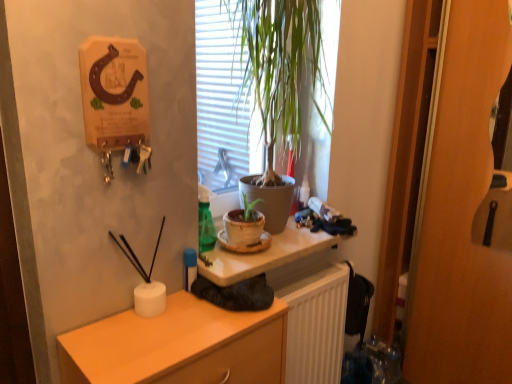
What is the approximate height of matte white desk at center?

matte white desk at center is 1.33 inches tall.

Measure the distance between point [155,350] and camera.

The distance of point [155,350] from camera is 35.87 inches.

What is the approximate width of matte orange cabinet at lower left?

It is 28.24 centimeters.

What do you see at coordinates (279, 68) in the screenshot?
I see `green leafy plant at center` at bounding box center [279, 68].

Image resolution: width=512 pixels, height=384 pixels. Describe the element at coordinates (315, 323) in the screenshot. I see `white ribbed radiator at lower center` at that location.

Locate an element on the screen. Image resolution: width=512 pixels, height=384 pixels. matte white desk at center is located at coordinates (266, 255).

From the image's perspective, is green leafy plant at center located above or below white ribbed radiator at lower center?

green leafy plant at center is above white ribbed radiator at lower center.

Is green leafy plant at center situated inside white ribbed radiator at lower center or outside?

green leafy plant at center is outside white ribbed radiator at lower center.

Does green leafy plant at center lie in front of white ribbed radiator at lower center?

Yes, green leafy plant at center is in front of white ribbed radiator at lower center.

Where is `houseplant in front of the white ribbed radiator at lower center`? The width and height of the screenshot is (512, 384). houseplant in front of the white ribbed radiator at lower center is located at coordinates (279, 68).

From a real-world perspective, who is located higher, matte orange cabinet at lower left or green leafy plant at center?

green leafy plant at center, from a real-world perspective.

Which of these two, matte orange cabinet at lower left or green leafy plant at center, is bigger?

green leafy plant at center.

From the image's perspective, who appears lower, matte orange cabinet at lower left or green leafy plant at center?

matte orange cabinet at lower left is shown below in the image.

Is matte orange cabinet at lower left far from green leafy plant at center?

No, matte orange cabinet at lower left is not far from green leafy plant at center.

Would you say matte white desk at center is a long distance from green leafy plant at center?

No, matte white desk at center is in close proximity to green leafy plant at center.

Which object is positioned more to the left, matte white desk at center or green leafy plant at center?

matte white desk at center is more to the left.

Does point (227, 270) appear closer or farther from the camera than point (254, 23)?

Clearly, point (227, 270) is closer to the camera than point (254, 23).

From a real-world perspective, relative to green leafy plant at center, is matte white desk at center vertically above or below?

Clearly, from a real-world perspective, matte white desk at center is below green leafy plant at center.

In the scene shown: Are white ribbed radiator at lower center and matte white desk at center far apart?

No, white ribbed radiator at lower center is not far away from matte white desk at center.

Could you tell me if white ribbed radiator at lower center is turned towards matte white desk at center?

No.

Considering the positions of point (328, 339) and point (255, 266), is point (328, 339) closer or farther from the camera than point (255, 266)?

Point (328, 339) appears to be farther away from the viewer than point (255, 266).

How many degrees apart are the facing directions of white ribbed radiator at lower center and matte white desk at center?

The facing directions of white ribbed radiator at lower center and matte white desk at center are 0.268 degrees apart.

Which of these two, green leafy plant at center or matte orange cabinet at lower left, stands shorter?

With less height is matte orange cabinet at lower left.

You are a GUI agent. You are given a task and a screenshot of the screen. Output one action in this format:
    pyautogui.click(x=<x>, y=<y>)
    Task: Click on the houseplant that appears on the right of matte orange cabinet at lower left
    The width and height of the screenshot is (512, 384).
    Given the screenshot: What is the action you would take?
    (x=279, y=68)

In the scene shown: From a real-world perspective, who is located higher, green leafy plant at center or matte orange cabinet at lower left?

In real-world perspective, green leafy plant at center is above.

Looking at this image, can you confirm if matte orange cabinet at lower left is taller than matte white desk at center?

Yes, matte orange cabinet at lower left is taller than matte white desk at center.

Is point (187, 356) closer to camera compared to point (284, 251)?

Yes, it is.

How far apart are matte orange cabinet at lower left and matte white desk at center?

They are 8.27 inches apart.

Consider the image. Which is more to the right, matte orange cabinet at lower left or matte white desk at center?

matte white desk at center.

Considering the relative positions of white ribbed radiator at lower center and green leafy plant at center in the image provided, is white ribbed radiator at lower center to the left of green leafy plant at center from the viewer's perspective?

No.

Does white ribbed radiator at lower center have a greater width compared to green leafy plant at center?

In fact, white ribbed radiator at lower center might be narrower than green leafy plant at center.

From the image's perspective, would you say white ribbed radiator at lower center is shown under green leafy plant at center?

Yes.

Image resolution: width=512 pixels, height=384 pixels. What are the coordinates of `houseplant in front of the white ribbed radiator at lower center` in the screenshot? It's located at (279, 68).

Locate an element on the screen. houseplant on the right of matte orange cabinet at lower left is located at coordinates (279, 68).

Estimate the real-world distances between objects in this image. Which object is further from matte white desk at center, green leafy plant at center or matte orange cabinet at lower left?

green leafy plant at center is positioned further to the anchor matte white desk at center.

Looking at the image, which one is located closer to matte orange cabinet at lower left, green leafy plant at center or matte white desk at center?

matte white desk at center.

From the image, which object appears to be nearer to matte orange cabinet at lower left, white ribbed radiator at lower center or matte white desk at center?

Among the two, matte white desk at center is located nearer to matte orange cabinet at lower left.

Considering their positions, is white ribbed radiator at lower center positioned closer to green leafy plant at center than matte white desk at center?

The object closer to green leafy plant at center is matte white desk at center.

Looking at the image, which one is located closer to green leafy plant at center, matte white desk at center or matte orange cabinet at lower left?

The object closer to green leafy plant at center is matte white desk at center.

Estimate the real-world distances between objects in this image. Which object is closer to matte orange cabinet at lower left, matte white desk at center or green leafy plant at center?

Based on the image, matte white desk at center appears to be nearer to matte orange cabinet at lower left.

When comparing their distances from matte white desk at center, does matte orange cabinet at lower left or green leafy plant at center seem further?

Based on the image, green leafy plant at center appears to be further to matte white desk at center.

When comparing their distances from matte orange cabinet at lower left, does green leafy plant at center or white ribbed radiator at lower center seem further?

green leafy plant at center is further to matte orange cabinet at lower left.

Where is `desk between matte orange cabinet at lower left and white ribbed radiator at lower center along the z-axis`? desk between matte orange cabinet at lower left and white ribbed radiator at lower center along the z-axis is located at coordinates (266, 255).

At what (x,y) coordinates should I click in order to perform the action: click on cabinetry between green leafy plant at center and white ribbed radiator at lower center in the up-down direction. Please return your answer as a coordinate pair (x, y). The width and height of the screenshot is (512, 384). Looking at the image, I should click on (179, 346).

The height and width of the screenshot is (384, 512). What are the coordinates of `desk between green leafy plant at center and white ribbed radiator at lower center in the vertical direction` in the screenshot? It's located at (266, 255).

I want to click on desk between green leafy plant at center and matte orange cabinet at lower left vertically, so click(x=266, y=255).